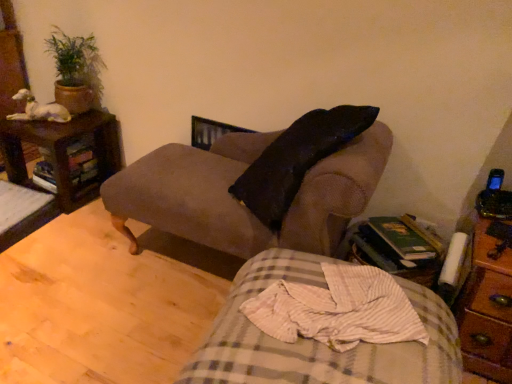
Question: Is white matte statue at upper left closer to the viewer compared to plaid fabric bed at lower center?

Choices:
 (A) no
 (B) yes

Answer: (A)

Question: From a real-world perspective, does white matte statue at upper left stand above plaid fabric bed at lower center?

Choices:
 (A) yes
 (B) no

Answer: (A)

Question: Is white matte statue at upper left shorter than plaid fabric bed at lower center?

Choices:
 (A) no
 (B) yes

Answer: (B)

Question: Is white matte statue at upper left at the left side of plaid fabric bed at lower center?

Choices:
 (A) no
 (B) yes

Answer: (B)

Question: Is white matte statue at upper left taller than plaid fabric bed at lower center?

Choices:
 (A) no
 (B) yes

Answer: (A)

Question: From the image's perspective, is white matte statue at upper left on plaid fabric bed at lower center?

Choices:
 (A) no
 (B) yes

Answer: (B)

Question: Is wooden side table at lower right further to the viewer compared to white matte statue at upper left?

Choices:
 (A) yes
 (B) no

Answer: (B)

Question: Is wooden side table at lower right located outside white matte statue at upper left?

Choices:
 (A) yes
 (B) no

Answer: (A)

Question: From the image's perspective, would you say wooden side table at lower right is positioned over white matte statue at upper left?

Choices:
 (A) no
 (B) yes

Answer: (A)

Question: From a real-world perspective, is wooden side table at lower right under white matte statue at upper left?

Choices:
 (A) no
 (B) yes

Answer: (B)

Question: Is wooden side table at lower right taller than white matte statue at upper left?

Choices:
 (A) no
 (B) yes

Answer: (A)

Question: Is wooden side table at lower right not near white matte statue at upper left?

Choices:
 (A) no
 (B) yes

Answer: (B)

Question: Can you confirm if brown wooden nightstand at left, arranged as the second nightstand when ordered from the bottom, is shorter than plaid fabric bed at lower center?

Choices:
 (A) yes
 (B) no

Answer: (A)